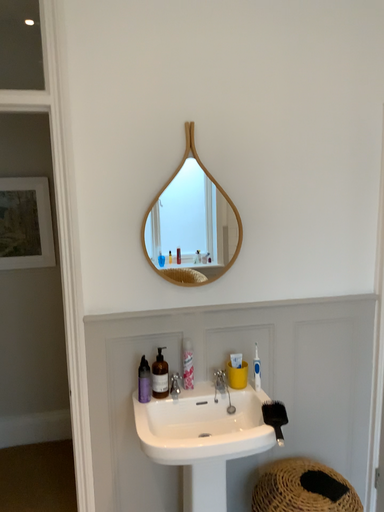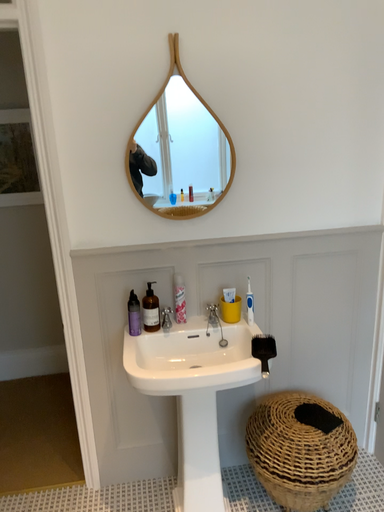
Question: How did the camera likely rotate when shooting the video?

Choices:
 (A) rotated upward
 (B) rotated downward

Answer: (B)